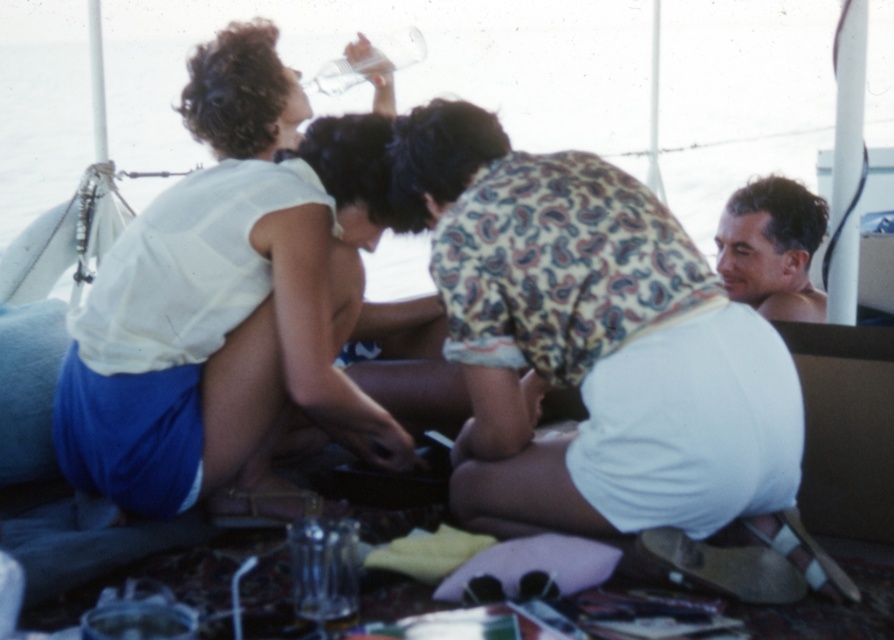
You are a photographer trying to capture a closeup shot of the person holding the clear plastic bottle. You are currently positioned at point A, which is at coordinates point [682,300]. There is an obstruction at point B at coordinates point [200,230]. Which point should you move to in order to get a clearer view of the person holding the bottle?

You should move to point A at coordinates point [682,300] because it is closer to the camera than point B at coordinates point [200,230], providing a clearer view.

Based on the scene description, where is the white cotton shirt at center located in terms of its 2D coordinates?

The white cotton shirt at center is located at the 2D coordinates of point (591,340).

In the scene shown: You are a photographer on a boat deck and want to take a photo of two people wearing white cotton shirts. The camera you have can only focus on objects within a 50 cm range. Can you capture both the white cotton shirt at center and the white cotton shirt at upper left in the same focused shot?

The white cotton shirt at center and white cotton shirt at upper left are 57.18 centimeters apart from each other. Since the camera can only focus within 50 cm, the distance between them exceeds the focus range. Therefore, you cannot capture both shirts in the same focused shot.